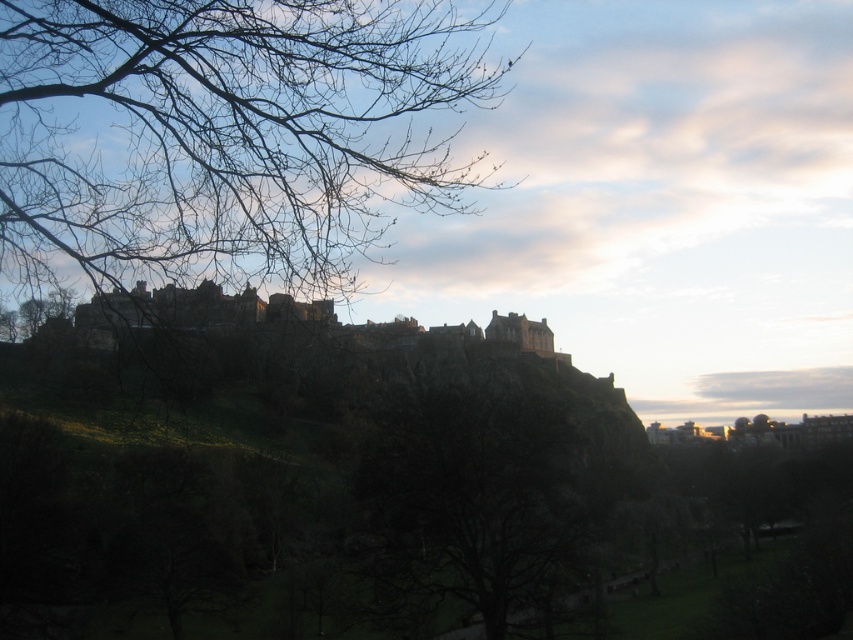
The image size is (853, 640). What do you see at coordinates (227, 134) in the screenshot?
I see `bare branches at upper left` at bounding box center [227, 134].

Does bare branches at upper left appear over bare branches at center?

Yes.

Does point (192, 173) lie behind point (393, 449)?

That is True.

You are a GUI agent. You are given a task and a screenshot of the screen. Output one action in this format:
    pyautogui.click(x=<x>, y=<y>)
    Task: Click on the bare branches at upper left
    This screenshot has width=853, height=640.
    Given the screenshot: What is the action you would take?
    pyautogui.click(x=227, y=134)